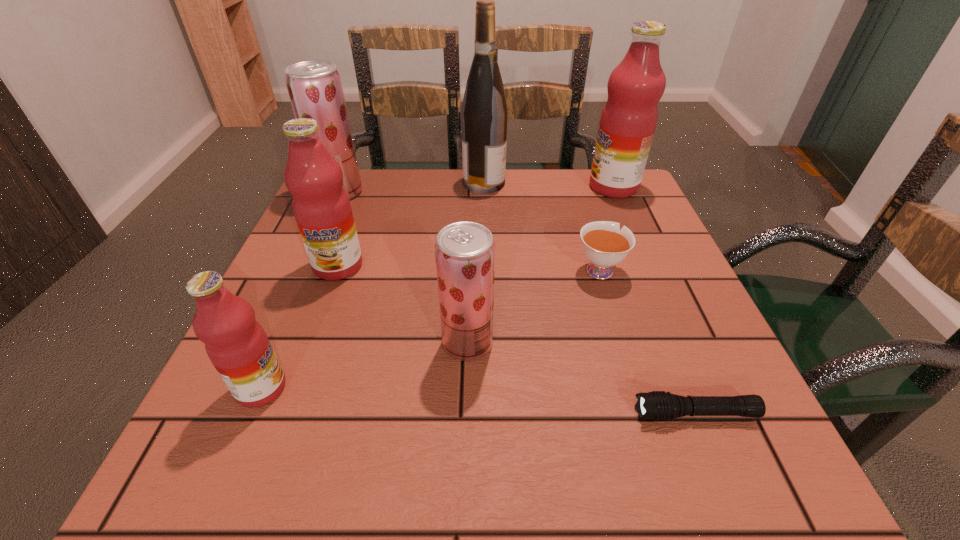
Locate an element on the screen. vacant space at the far right corner is located at coordinates (626, 215).

The height and width of the screenshot is (540, 960). I want to click on free spot between the bigger strawberry fruit juice and the wine bottle, so click(x=412, y=187).

Find the location of `free point between the nearest fruit juice and the third farthest fruit juice`. free point between the nearest fruit juice and the third farthest fruit juice is located at coordinates [x=300, y=327].

Where is `free space between the second fruit juice from right to left and the farthest pink fruit juice`? The width and height of the screenshot is (960, 540). free space between the second fruit juice from right to left and the farthest pink fruit juice is located at coordinates (540, 265).

Identify the location of vacant space that is in between the farther strawberry fruit juice and the third nearest object. (404, 267).

Identify the location of vacant region between the nearest pink fruit juice and the rightmost fruit juice. (438, 287).

At what (x,y) coordinates should I click in order to perform the action: click on vacant space in between the nearest fruit juice and the wine bottle. Please return your answer as a coordinate pair (x, y). Looking at the image, I should click on (372, 285).

Identify the location of vacant space in between the flashlight and the nearer strawberry fruit juice. (582, 379).

Identify the location of object that ranks as the second closest to the rightmost fruit juice. (484, 113).

Point out which object is positioned as the nearest to the left strawberry fruit juice. Please provide its 2D coordinates. Your answer should be formatted as a tuple, i.e. [(x, y)], where the tuple contains the x and y coordinates of a point satisfying the conditions above.

[(321, 206)]